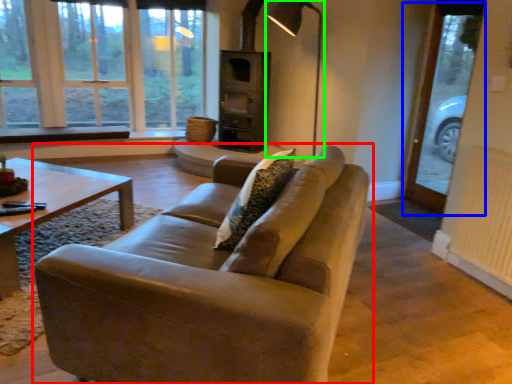
Question: Estimate the real-world distances between objects in this image. Which object is farther from studio couch (highlighted by a red box), screen door (highlighted by a blue box) or lamp (highlighted by a green box)?

Choices:
 (A) screen door
 (B) lamp

Answer: (B)